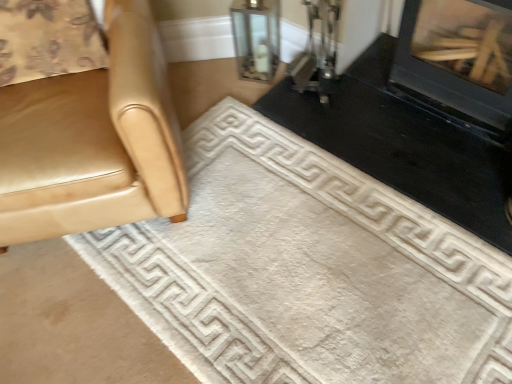
Question: Is clear glass vase at upper center at the left side of black glossy fireplace at upper right, marked as the 1th fireplace in a left-to-right arrangement?

Choices:
 (A) no
 (B) yes

Answer: (B)

Question: Does clear glass vase at upper center have a lesser height compared to black glossy fireplace at upper right, the 2th fireplace in the right-to-left sequence?

Choices:
 (A) yes
 (B) no

Answer: (B)

Question: Can you confirm if clear glass vase at upper center is wider than black glossy fireplace at upper right, marked as the 1th fireplace in a left-to-right arrangement?

Choices:
 (A) no
 (B) yes

Answer: (A)

Question: Could you tell me if clear glass vase at upper center is facing black glossy fireplace at upper right, the 2th fireplace in the right-to-left sequence?

Choices:
 (A) no
 (B) yes

Answer: (A)

Question: From the image's perspective, does clear glass vase at upper center appear lower than black glossy fireplace at upper right, the 2th fireplace in the right-to-left sequence?

Choices:
 (A) yes
 (B) no

Answer: (B)

Question: Considering their positions, is black glossy fireplace at upper right, the 2th fireplace in the right-to-left sequence, located in front of or behind black glass fireplace at upper right, the second fireplace positioned from the left?

Choices:
 (A) front
 (B) behind

Answer: (B)

Question: Is black glossy fireplace at upper right, marked as the 1th fireplace in a left-to-right arrangement, taller or shorter than black glass fireplace at upper right, the first fireplace from the right?

Choices:
 (A) tall
 (B) short

Answer: (B)

Question: Is point (472, 152) positioned closer to the camera than point (418, 13)?

Choices:
 (A) farther
 (B) closer

Answer: (A)

Question: From a real-world perspective, is black glossy fireplace at upper right, marked as the 1th fireplace in a left-to-right arrangement, positioned above or below black glass fireplace at upper right, the first fireplace from the right?

Choices:
 (A) above
 (B) below

Answer: (B)

Question: Visually, is white soft rug at center positioned to the left or to the right of matte gold chair at left?

Choices:
 (A) right
 (B) left

Answer: (A)

Question: From the image's perspective, is white soft rug at center above or below matte gold chair at left?

Choices:
 (A) below
 (B) above

Answer: (A)

Question: Considering the positions of white soft rug at center and matte gold chair at left in the image, is white soft rug at center taller or shorter than matte gold chair at left?

Choices:
 (A) short
 (B) tall

Answer: (A)

Question: Would you say white soft rug at center is inside or outside matte gold chair at left?

Choices:
 (A) outside
 (B) inside

Answer: (A)

Question: In the image, is matte gold chair at left positioned in front of or behind white soft rug at center?

Choices:
 (A) behind
 (B) front

Answer: (B)

Question: Is matte gold chair at left situated inside white soft rug at center or outside?

Choices:
 (A) inside
 (B) outside

Answer: (B)